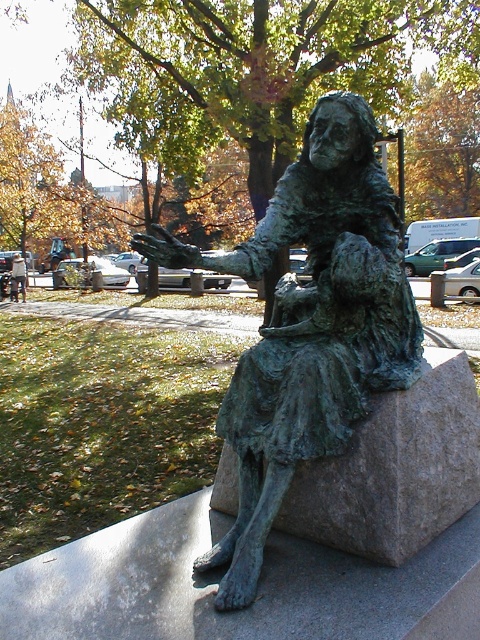
Question: Which point is farther from the camera taking this photo?

Choices:
 (A) (14, 276)
 (B) (384, 561)
 (C) (389, 272)

Answer: (A)

Question: Is the position of green patina bronze statue at center more distant than that of metallic gray statue at center?

Choices:
 (A) yes
 (B) no

Answer: (B)

Question: Which object is the closest to the metallic gray statue at center?

Choices:
 (A) green patina stone at center
 (B) green patina bronze statue at center

Answer: (B)

Question: Can you confirm if green patina bronze statue at center is positioned below green patina stone at center?

Choices:
 (A) no
 (B) yes

Answer: (A)

Question: Based on their relative distances, which object is farther from the green patina bronze statue at center?

Choices:
 (A) green patina stone at center
 (B) metallic gray statue at center

Answer: (B)

Question: Where is green patina bronze statue at center located in relation to metallic gray statue at center in the image?

Choices:
 (A) left
 (B) right

Answer: (B)